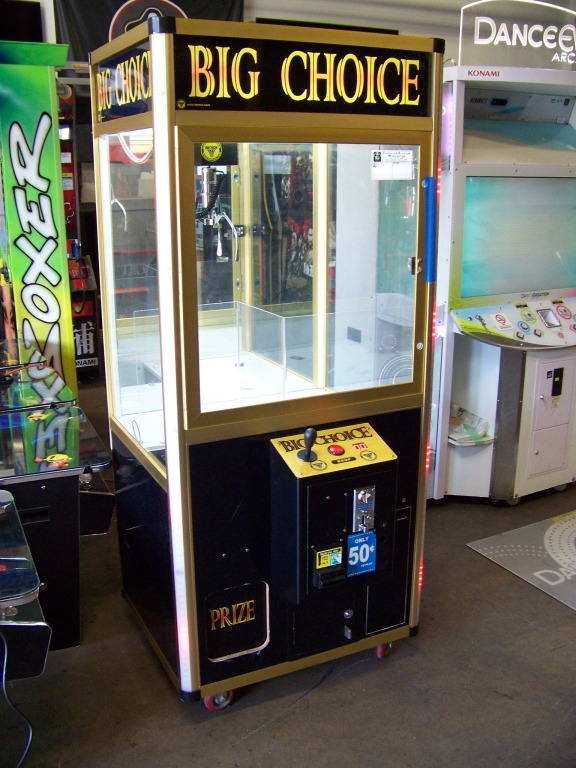
This screenshot has width=576, height=768. I want to click on floor mat, so click(529, 561).